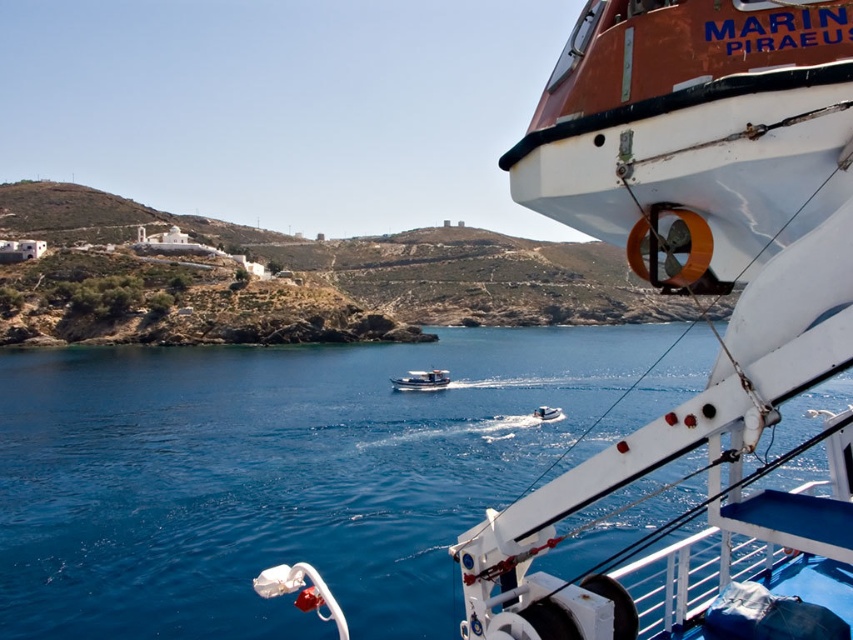
Describe the element at coordinates (276, 476) in the screenshot. Image resolution: width=853 pixels, height=640 pixels. I see `blue water at center` at that location.

Between blue water at center and white plastic boat at center, which one appears on the right side from the viewer's perspective?

From the viewer's perspective, white plastic boat at center appears more on the right side.

This screenshot has width=853, height=640. What do you see at coordinates (276, 476) in the screenshot?
I see `blue water at center` at bounding box center [276, 476].

Where is `blue water at center`? blue water at center is located at coordinates (276, 476).

Is white glossy motorboat at center shorter than white plastic boat at center?

No, white glossy motorboat at center is not shorter than white plastic boat at center.

Measure the distance from white glossy motorboat at center to white plastic boat at center.

white glossy motorboat at center and white plastic boat at center are 17.33 meters apart.

Locate an element on the screen. white glossy motorboat at center is located at coordinates (421, 380).

Is blue water at center below white glossy motorboat at center?

No.

Does blue water at center appear on the right side of white glossy motorboat at center?

No, blue water at center is not to the right of white glossy motorboat at center.

Is point (24, 497) positioned in front of point (395, 381)?

Yes, point (24, 497) is in front of point (395, 381).

At what (x,y) coordinates should I click in order to perform the action: click on blue water at center. Please return your answer as a coordinate pair (x, y). The height and width of the screenshot is (640, 853). Looking at the image, I should click on (276, 476).